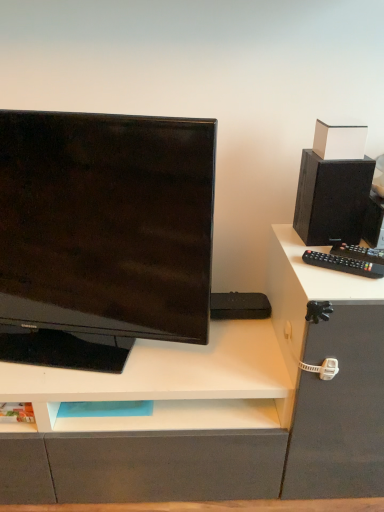
Question: Is black plastic remote control at right smaller than black matte speaker at upper right?

Choices:
 (A) yes
 (B) no

Answer: (A)

Question: Can you confirm if black plastic remote control at right is positioned to the left of black matte speaker at upper right?

Choices:
 (A) no
 (B) yes

Answer: (B)

Question: Is black plastic remote control at right wider than black matte speaker at upper right?

Choices:
 (A) yes
 (B) no

Answer: (B)

Question: From a real-world perspective, is black plastic remote control at right on top of black matte speaker at upper right?

Choices:
 (A) no
 (B) yes

Answer: (A)

Question: From the image's perspective, is black plastic remote control at right over black matte speaker at upper right?

Choices:
 (A) yes
 (B) no

Answer: (B)

Question: Is black plastic remote control at right closer to camera compared to black matte speaker at upper right?

Choices:
 (A) yes
 (B) no

Answer: (A)

Question: Can you confirm if matte black monitor at left is thinner than white matte box at upper right?

Choices:
 (A) yes
 (B) no

Answer: (B)

Question: From the image's perspective, would you say matte black monitor at left is positioned over white matte box at upper right?

Choices:
 (A) no
 (B) yes

Answer: (A)

Question: Can you confirm if matte black monitor at left is positioned to the left of white matte box at upper right?

Choices:
 (A) no
 (B) yes

Answer: (B)

Question: From the image's perspective, is matte black monitor at left located beneath white matte box at upper right?

Choices:
 (A) yes
 (B) no

Answer: (A)

Question: Considering the relative positions of matte black monitor at left and white matte box at upper right in the image provided, is matte black monitor at left in front of white matte box at upper right?

Choices:
 (A) no
 (B) yes

Answer: (B)

Question: Is matte black monitor at left facing towards white matte box at upper right?

Choices:
 (A) no
 (B) yes

Answer: (A)

Question: Considering the relative sizes of black matte speaker at upper right and matte black monitor at left in the image provided, is black matte speaker at upper right thinner than matte black monitor at left?

Choices:
 (A) no
 (B) yes

Answer: (A)